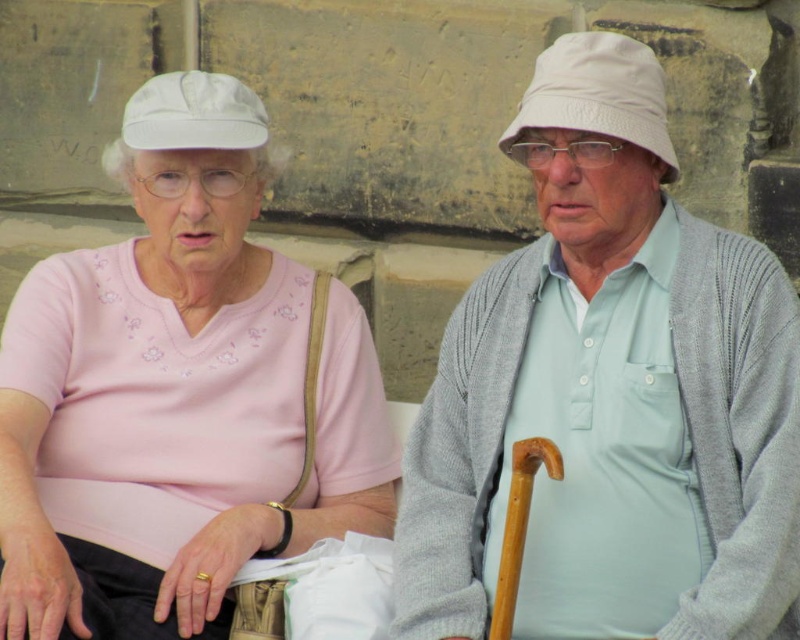
Consider the image. You are a photographer trying to capture a closeup of the matte pink shirt at center. Based on its coordinates, where should you position your camera relative to the two elderly individuals?

The matte pink shirt at center is located at point (x=178, y=394), which means it is positioned slightly to the right and lower center of the image. To capture a closeup, the camera should be positioned slightly to the right and lower center relative to the two elderly individuals.

You are a photographer trying to capture a candid shot of both the matte pink shirt at center and the white fabric baseball hat at upper right. Since you want to ensure both subjects are in focus, you need to know their vertical positions. Based on the scene, which object is lower in the image?

The matte pink shirt at center is positioned under the white fabric baseball hat at upper right, so the matte pink shirt at center is lower in the image.

You are a photographer taking a picture of two elderly people sitting together. You notice the light gray knit sweater at center and the white fabric baseball cap at upper left. Which object should you focus on first if you want to capture the one that is positioned more to the left?

The white fabric baseball cap at upper left is positioned more to the left, so you should focus on it first.